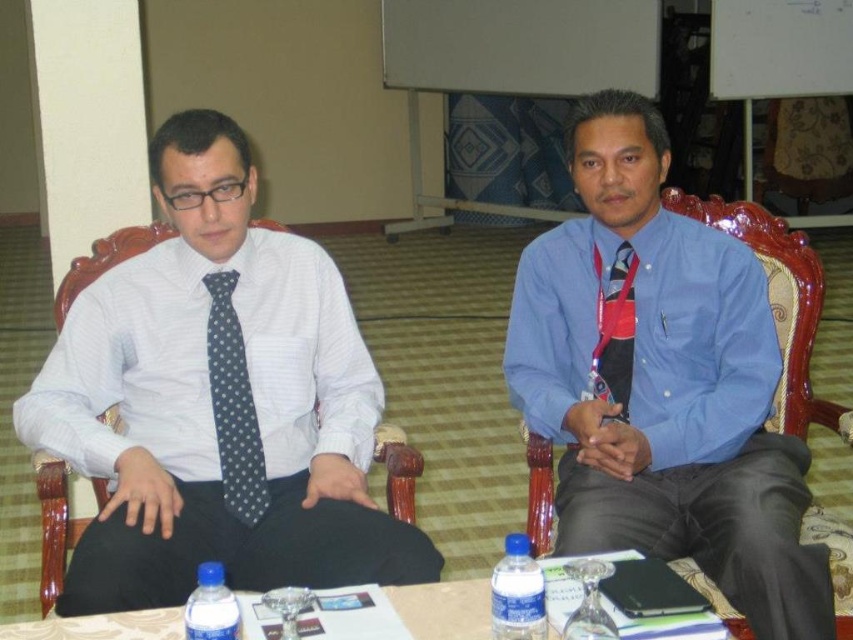
Question: Can you confirm if blue satin shirt at center is positioned below gray dotted tie at left?

Choices:
 (A) no
 (B) yes

Answer: (A)

Question: Which object is the closest to the translucent glass table at lower center?

Choices:
 (A) gray dotted tie at left
 (B) wooden chair at left
 (C) polka dot fabric tie at center
 (D) blue satin shirt at center

Answer: (B)

Question: Which object is the closest to the blue plastic bottle at center?

Choices:
 (A) translucent glass table at lower center
 (B) blue satin shirt at center
 (C) blue plastic bottle at lower left
 (D) wooden chair at left

Answer: (A)

Question: Is gray dotted tie at left above blue plastic bottle at lower left?

Choices:
 (A) no
 (B) yes

Answer: (B)

Question: Which of the following is the farthest from the observer?

Choices:
 (A) (236, 609)
 (B) (511, 563)
 (C) (405, 552)

Answer: (C)

Question: Can you confirm if blue satin shirt at center is positioned above translucent glass table at lower center?

Choices:
 (A) no
 (B) yes

Answer: (B)